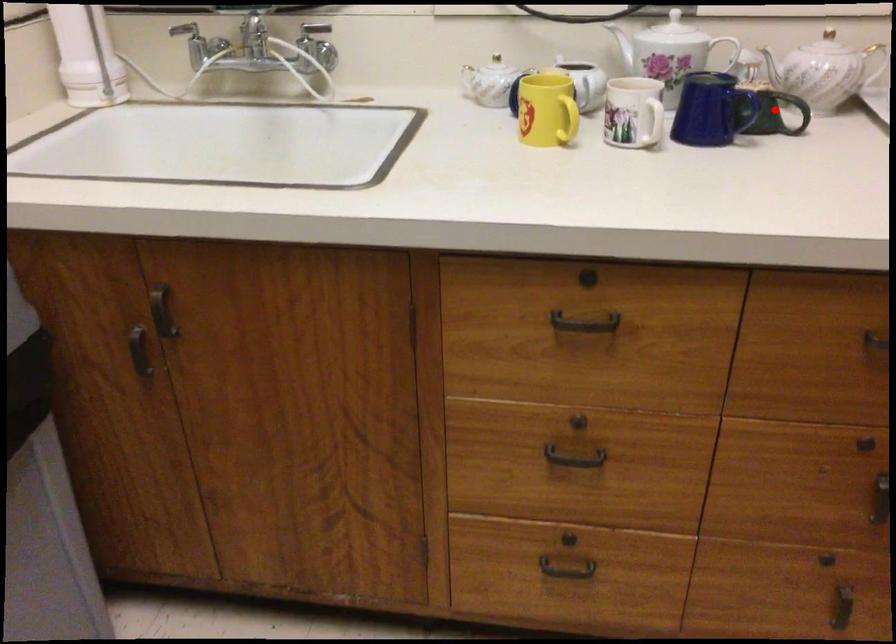
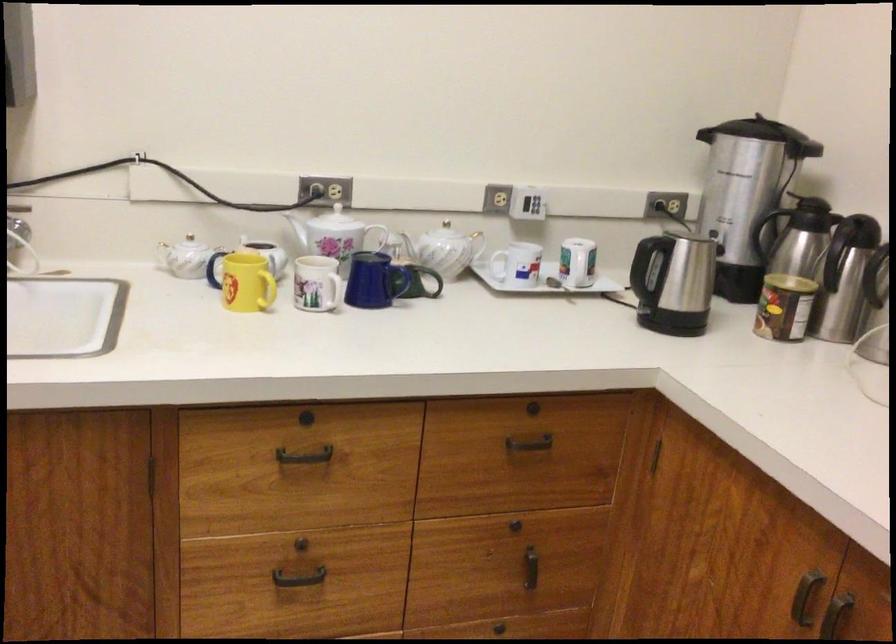
Question: I am providing you with two images of the same scene from different viewpoints. A red point is marked on the first image. Can you still see the location of the red point in image 2?

Choices:
 (A) Yes
 (B) No

Answer: (A)